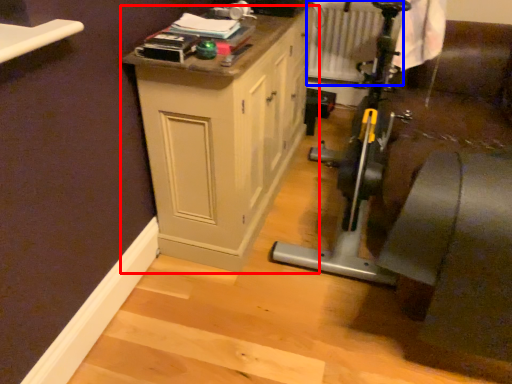
Question: Which point is closer to the camera, cabinetry (highlighted by a red box) or radiator (highlighted by a blue box)?

Choices:
 (A) cabinetry
 (B) radiator

Answer: (A)